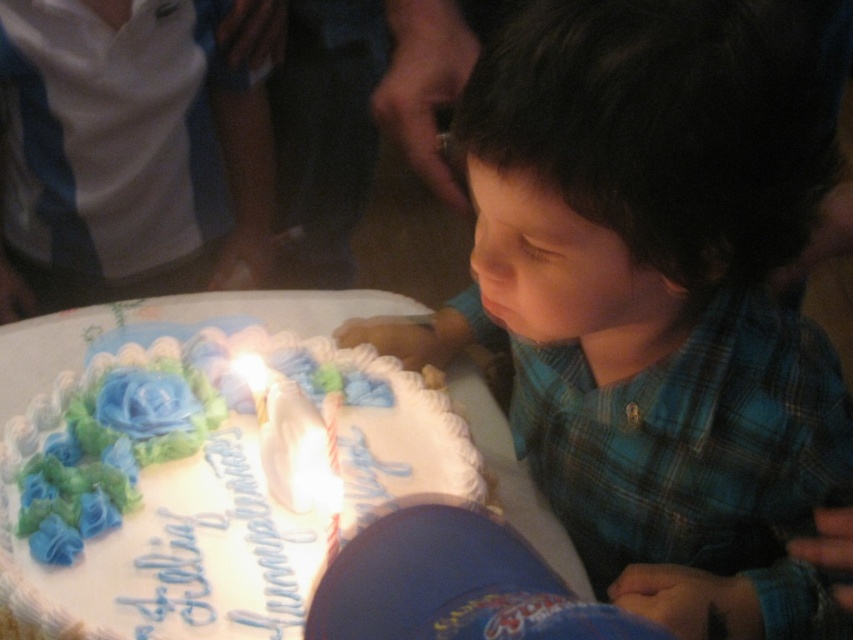
Does blue plaid shirt at center have a greater height compared to white frosted cake at lower left?

Yes, blue plaid shirt at center is taller than white frosted cake at lower left.

Between point (625, 228) and point (193, 634), which one is positioned behind?

Point (193, 634)

Find the location of `blue plaid shirt at center`. blue plaid shirt at center is located at coordinates (656, 298).

Is point (187, 515) closer to camera compared to point (306, 433)?

No, it is behind (306, 433).

Find the location of `white frosted cake at lower left`. white frosted cake at lower left is located at coordinates (201, 486).

Is point (695, 240) farther from viewer compared to point (339, 502)?

No, (695, 240) is in front of (339, 502).

How much distance is there between blue plaid shirt at center and white wax candle at center?

blue plaid shirt at center and white wax candle at center are 28.86 centimeters apart.

Who is more distant from viewer, (643, 611) or (283, 474)?

Point (283, 474)

The image size is (853, 640). I want to click on blue plaid shirt at center, so coord(656,298).